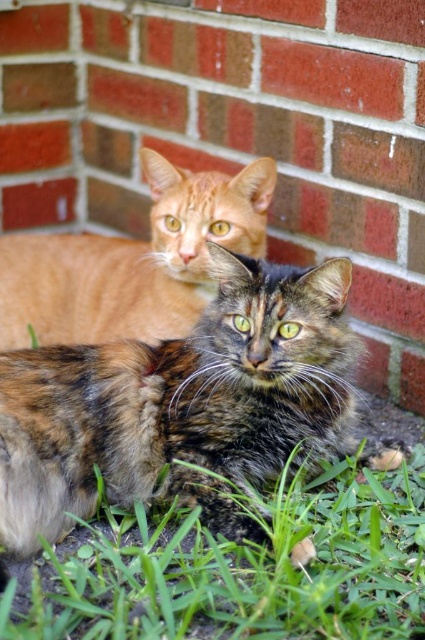
You are a photographer trying to capture a closeup of the calico fur cat at center. You are currently standing at the point marked by point (183, 404). Is the calico fur cat at center in front of or behind the photographer?

The point (183, 404) marks the calico fur cat at center, so the photographer is standing exactly where the calico fur cat at center is located. Therefore, the calico fur cat at center cannot be in front or behind the photographer since they are at the same position.

You are a photographer trying to capture both cats in a single frame. Given that the camera can only focus on one cat at a time, which cat should you focus on to ensure the calico fur cat at center and the orange fur cat at upper center are both in the frame?

The calico fur cat at center is wider than the orange fur cat at upper center, so focusing on the calico fur cat at center will ensure both cats are within the frame since its larger size can help frame the composition better.

You are standing 5 feet away from a brick wall and see a calico fur cat at center. Can you safely step forward to touch the cat without stepping into the brick wall?

The calico fur cat at center is 4.96 feet away from you. Since you are 5 feet away from the brick wall, stepping forward to touch the cat would place you closer than 5 feet, potentially stepping into the wall. Therefore, you cannot safely step forward to touch the cat without getting too close to the wall.